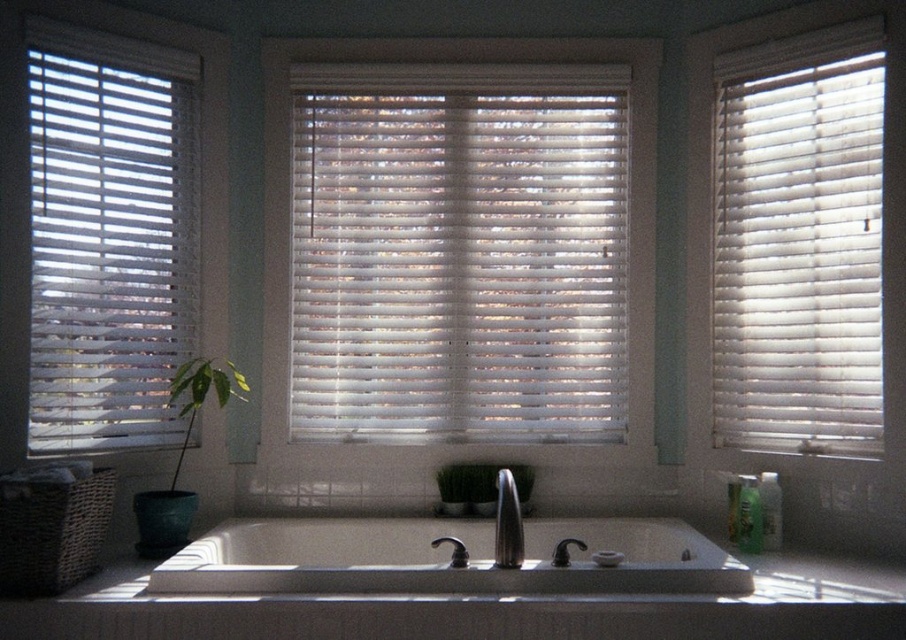
Find the location of `white wood blinds at left`. white wood blinds at left is located at coordinates (109, 237).

Does point (42, 426) lie in front of point (507, 557)?

No, (42, 426) is further to viewer.

Between point (95, 388) and point (511, 525), which one is positioned in front?

Point (511, 525)

Identify the location of white wood blinds at left. Image resolution: width=906 pixels, height=640 pixels. (109, 237).

Is point (721, 241) positioned after point (525, 467)?

No, it is not.

Is point (711, 408) positioned in front of point (442, 504)?

No.

Where is `white wood blinds at right`? This screenshot has width=906, height=640. white wood blinds at right is located at coordinates (798, 243).

Can you confirm if white matte sink at center is positioned below green leafy plant at left?

Indeed, white matte sink at center is positioned under green leafy plant at left.

At what (x,y) coordinates should I click in order to perform the action: click on white matte sink at center. Please return your answer as a coordinate pair (x, y). This screenshot has height=640, width=906. Looking at the image, I should click on (449, 557).

Which is behind, point (630, 570) or point (186, 394)?

The point (186, 394) is behind.

The image size is (906, 640). I want to click on white matte sink at center, so click(x=449, y=557).